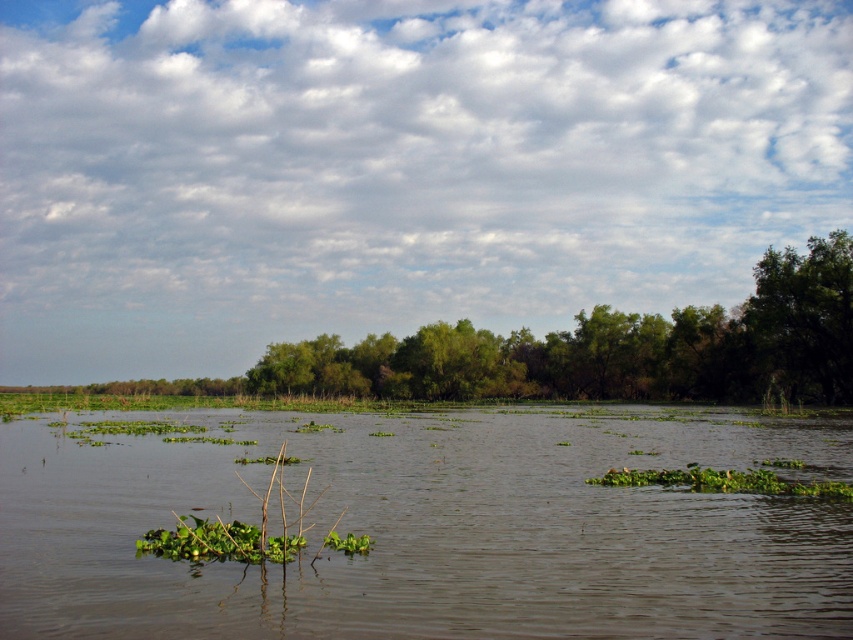
Based on the photo, you are standing on the shore looking at the green leafy vegetation at center and the green leafy tree at right. Which one is closer to the water surface?

The green leafy vegetation at center is closer to the water surface because it is positioned below the green leafy tree at right.

You are standing at the left edge of the scene and want to walk towards the green leafy tree at right. Which direction should you head in relation to the green leafy plant at center?

You should head to the right of the green leafy plant at center because the green leafy tree at right is located to the right of it.